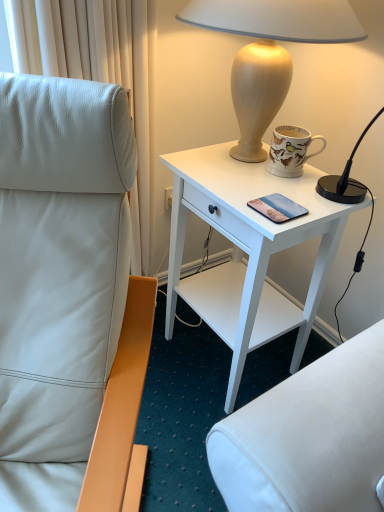
What are the coordinates of `free location in front of porcelain mug with bird illustrations at upper right` in the screenshot? It's located at (295, 193).